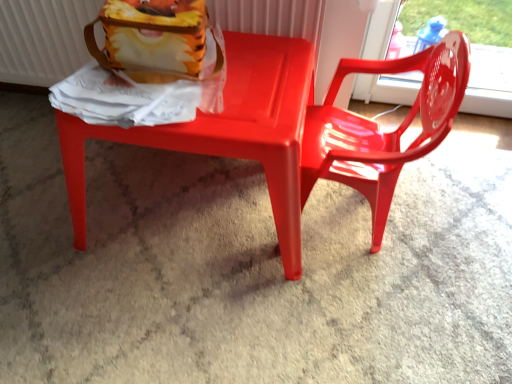
Where is `free spot above matte plastic chair at center, the 2th chair positioned from the right (from a real-world perspective)`? The width and height of the screenshot is (512, 384). free spot above matte plastic chair at center, the 2th chair positioned from the right (from a real-world perspective) is located at coordinates (234, 93).